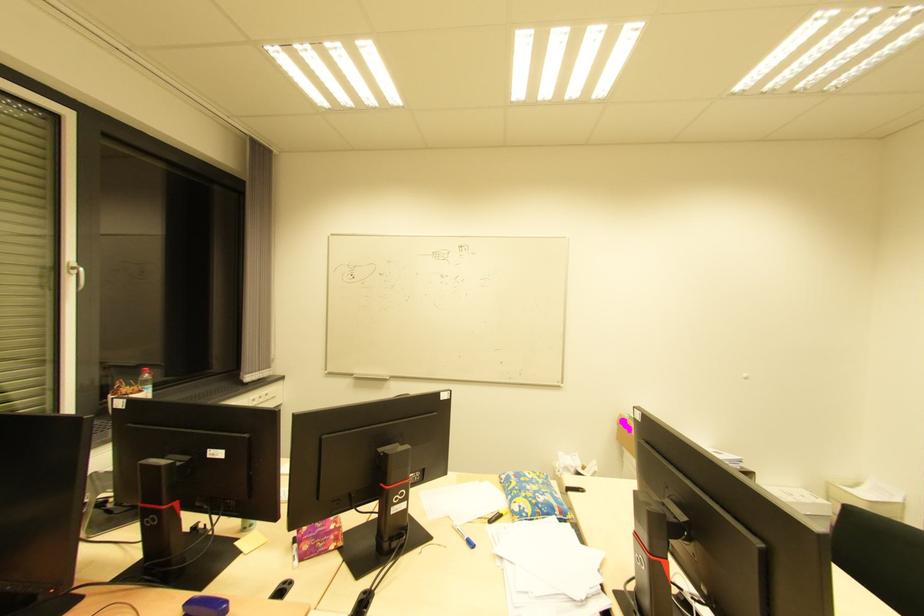
Find where to lift the blue plastic case. Please return your answer as a coordinate pair (x, y).

(205, 606)